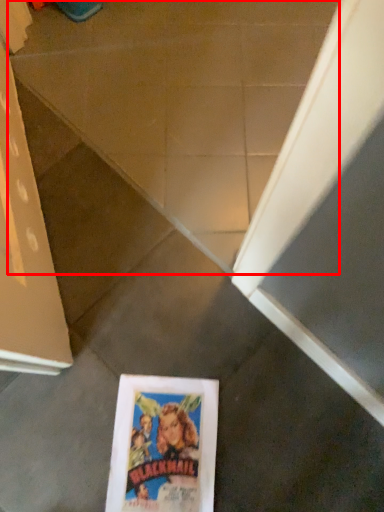
Question: Where is concrete (annotated by the red box) located in relation to paperback book in the image?

Choices:
 (A) left
 (B) right

Answer: (B)